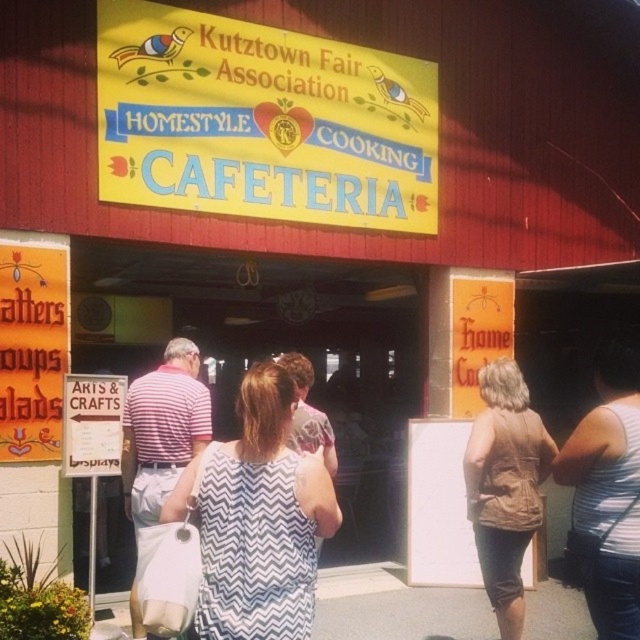
You are a visitor at the Kutztown Fair Association cafeteria entrance and want to know which object is wider between the brown leather vest at lower right and the white matte bulletin board at center. Can you tell me?

The brown leather vest at lower right is less wide than the white matte bulletin board at center.

You are standing at the entrance of the cafeteria and want to check if the yellow paper sign at upper center is taller than the white zigzag dress at center. Based on the scene description, can you confirm this?

The yellow paper sign at upper center has a greater height compared to the white zigzag dress at center, so yes, the yellow paper sign at upper center is taller than the white zigzag dress at center.

You are a visitor at the Kutztown Fair Association cafeteria entrance. You notice two items near the entrance. The first is a brown leather vest at lower right and the second is a white matte bulletin board at center. Which item is bigger in size?

The brown leather vest at lower right has a larger size compared to the white matte bulletin board at center.